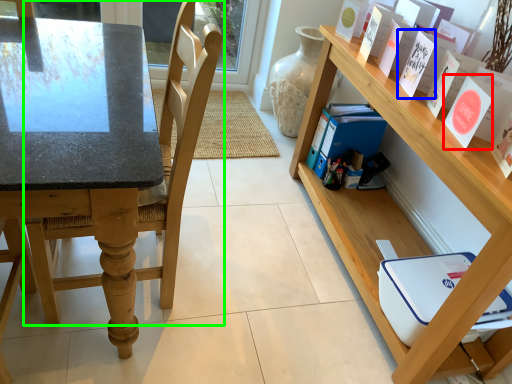
Question: Which object is the closest to the paperback book (highlighted by a red box)? Choose among these: paperback book (highlighted by a blue box) or chair (highlighted by a green box).

Choices:
 (A) paperback book
 (B) chair

Answer: (A)